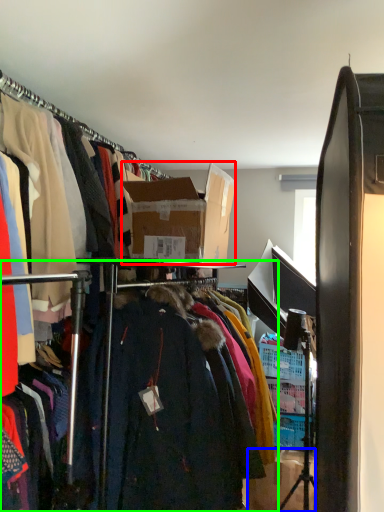
Question: Based on their relative distances, which object is farther from box (highlighted by a red box)? Choose from box (highlighted by a blue box) and closet (highlighted by a green box).

Choices:
 (A) box
 (B) closet

Answer: (A)